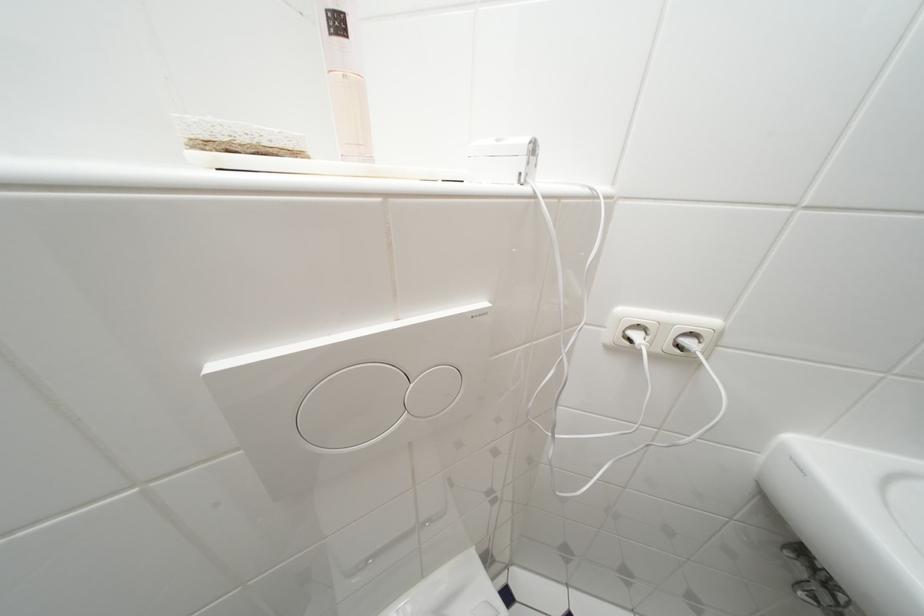
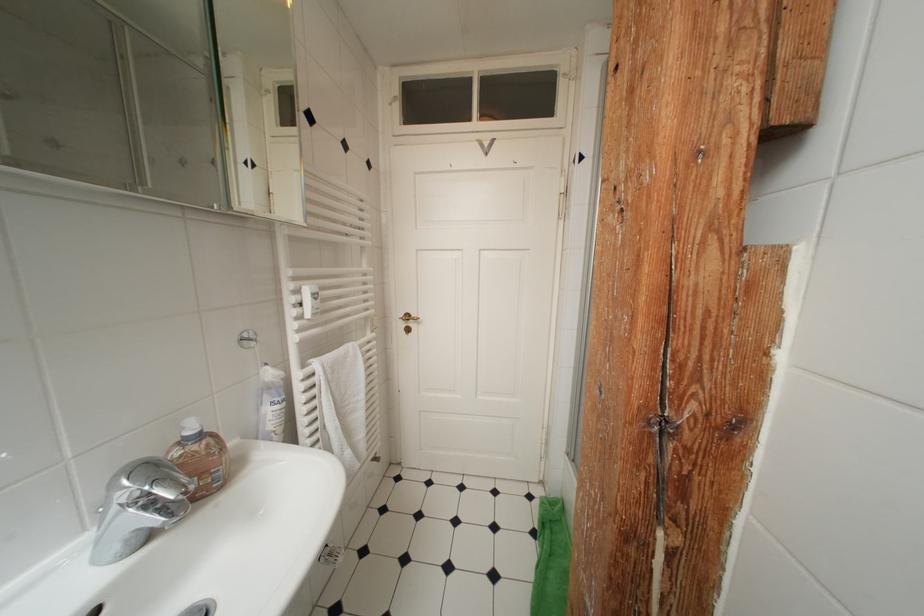
Question: Based on the continuous images, in which direction is the camera rotating? Reply with the corresponding letter.

Choices:
 (A) Left
 (B) Right
 (C) Up
 (D) Down

Answer: (B)